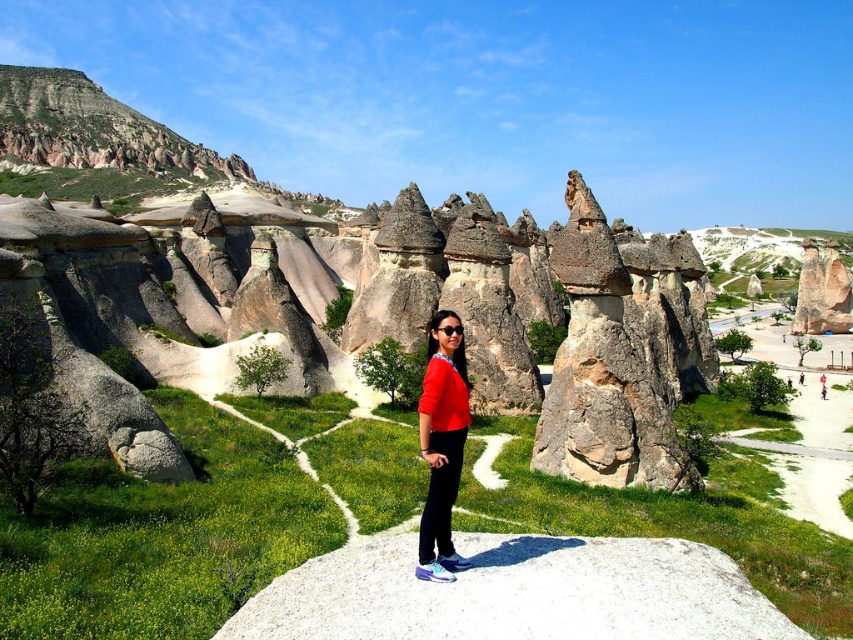
Question: Does rustic stone rock formation at center have a smaller size compared to red matte sweater at center?

Choices:
 (A) no
 (B) yes

Answer: (A)

Question: From the image, what is the correct spatial relationship of rustic stone rock formation at center in relation to red matte sweater at center?

Choices:
 (A) left
 (B) right

Answer: (A)

Question: Can you confirm if rustic stone rock formation at center is smaller than red matte sweater at center?

Choices:
 (A) yes
 (B) no

Answer: (B)

Question: Which point is farther to the camera?

Choices:
 (A) rustic stone rock formation at center
 (B) red matte sweater at center

Answer: (A)

Question: Which of the following is the farthest from the observer?

Choices:
 (A) (447, 470)
 (B) (254, 294)

Answer: (B)